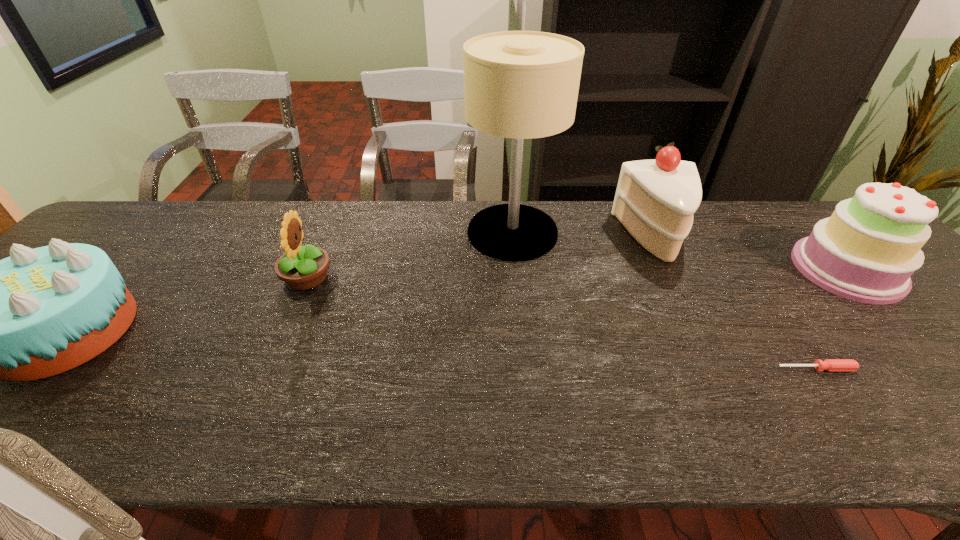
Locate which cake ranks in proximity to the shortest cake. Please provide its 2D coordinates. Your answer should be formatted as a tuple, i.e. [(x, y)], where the tuple contains the x and y coordinates of a point satisfying the conditions above.

[(655, 200)]

The width and height of the screenshot is (960, 540). Identify the location of free spot that satisfies the following two spatial constraints: 1. on the face of the second object from left to right; 2. on the left side of the second object from right to left. (268, 369).

In order to click on free region that satisfies the following two spatial constraints: 1. on the front side of the second cake from left to right; 2. on the face of the fifth object from right to left in this screenshot , I will do `click(677, 278)`.

Where is `free region that satisfies the following two spatial constraints: 1. on the front side of the rightmost cake; 2. on the face of the sunflower`? Image resolution: width=960 pixels, height=540 pixels. free region that satisfies the following two spatial constraints: 1. on the front side of the rightmost cake; 2. on the face of the sunflower is located at coordinates (855, 278).